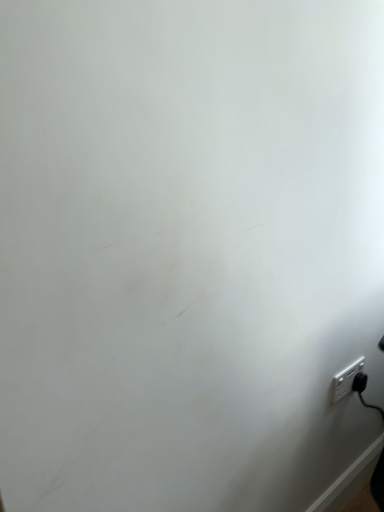
Image resolution: width=384 pixels, height=512 pixels. Identify the location of white plastic power plug at lower right. (345, 380).

This screenshot has width=384, height=512. What do you see at coordinates (345, 380) in the screenshot?
I see `white plastic power plug at lower right` at bounding box center [345, 380].

Measure the distance between white plastic power plug at lower right and camera.

white plastic power plug at lower right and camera are 1.09 meters apart.

This screenshot has width=384, height=512. In order to click on white plastic power plug at lower right in this screenshot , I will do `click(345, 380)`.